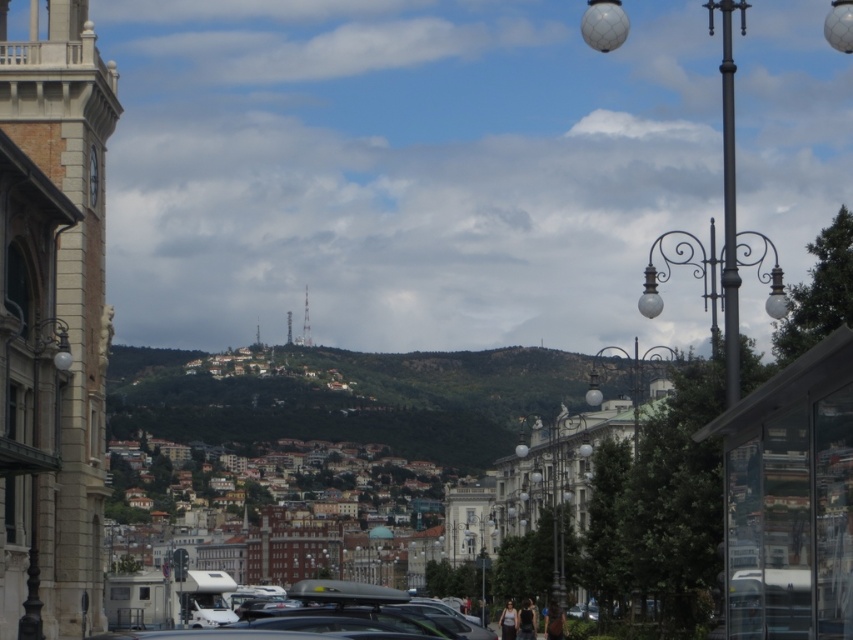
You are a city planner assessing the placement of streetlights in this urban area. Given that the polished brass lamp post at left is taller than the white glass lamp post at right, which lamp post would be more suitable for illuminating a narrow alleyway where height restrictions are in place?

The white glass lamp post at right is shorter than the polished brass lamp post at left, making it more suitable for narrow alleyways with height restrictions.

You are an architect planning to build a new structure between the light beige stone bell tower at left and the green textured hillside at center. Based on their sizes, which one should you place closer to the front of your design to maintain visual balance?

The light beige stone bell tower at left is smaller than the green textured hillside at center, so to maintain visual balance, you should place the light beige stone bell tower at left closer to the front of your design.

Looking at this image, you are a city planner evaluating the placement of the white glass lamp post at right and the polished brass lamp post at left. Based on their sizes, which lamp post would be more suitable for illuminating a larger public square?

The white glass lamp post at right is larger in size than the polished brass lamp post at left, so it would be more suitable for illuminating a larger public square.